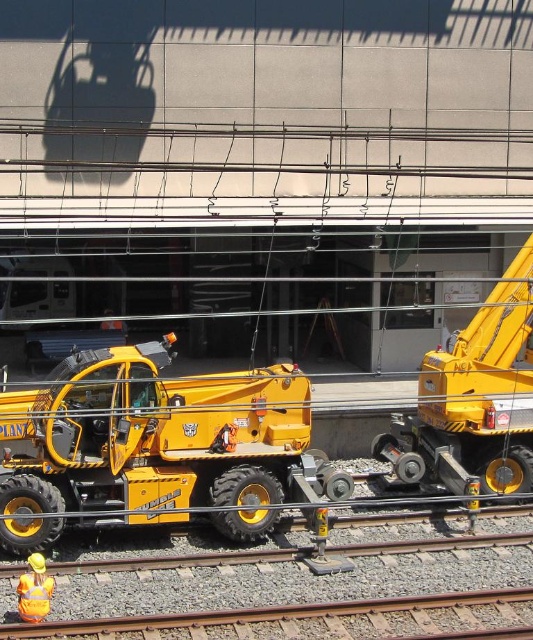
Question: Is gray gravel train track at lower center above reflective yellow vest at lower left?

Choices:
 (A) yes
 (B) no

Answer: (B)

Question: From the image, what is the correct spatial relationship of yellow rubber truck at center in relation to yellow rubber crane at center?

Choices:
 (A) left
 (B) right

Answer: (A)

Question: Is yellow rubber truck at center to the right of reflective yellow vest at lower left from the viewer's perspective?

Choices:
 (A) no
 (B) yes

Answer: (B)

Question: Considering the real-world distances, which object is closest to the yellow rubber crane at center?

Choices:
 (A) gray gravel train track at lower center
 (B) yellow rubber truck at center
 (C) reflective yellow vest at lower left

Answer: (B)

Question: Considering the real-world distances, which object is closest to the gray gravel train track at lower center?

Choices:
 (A) yellow rubber truck at center
 (B) reflective yellow vest at lower left
 (C) yellow rubber crane at center

Answer: (B)

Question: Which is nearer to the gray gravel train track at lower center?

Choices:
 (A) reflective yellow vest at lower left
 (B) yellow rubber truck at center

Answer: (A)